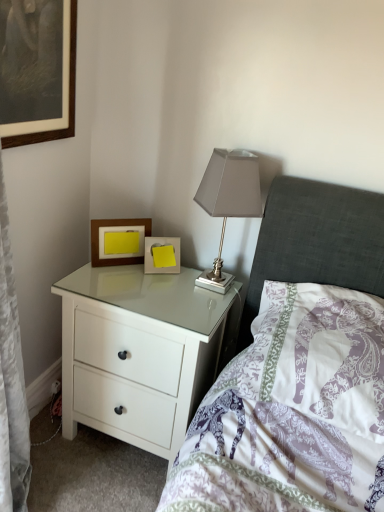
This screenshot has width=384, height=512. What are the coordinates of `vacant space that's between wooden picture frame at upper left, which appears as the second picture frame when viewed from the right, and yellow paper at center, which is the 1th picture frame in right-to-left order` in the screenshot? It's located at (125, 270).